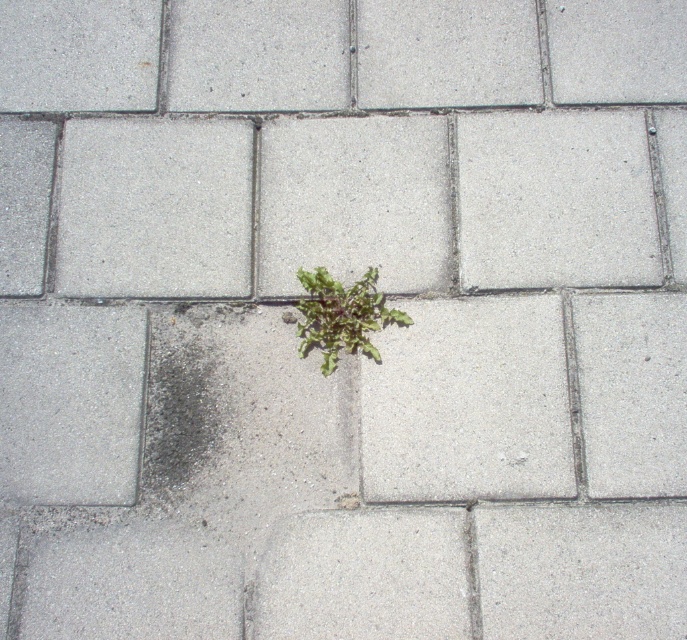
You are a gardener trying to maintain the paved area. You notice the dark gray gravel at center and the green leafy plant at center. Which one is taller?

The dark gray gravel at center is taller than the green leafy plant at center.

In the scene shown: You are a gardener trying to maintain the paved area. You notice the dark gray gravel at center and the green leafy plant at center. Which one takes up more space in the paved area?

The dark gray gravel at center is larger in size than the green leafy plant at center, so it takes up more space in the paved area.

You are a gardener trying to remove weeds from the dark gray gravel at center. You notice the green leafy plant at center growing there. Is the plant growing above or below the gravel?

The dark gray gravel at center is in front of green leafy plant at center, meaning the plant is growing below the gravel.